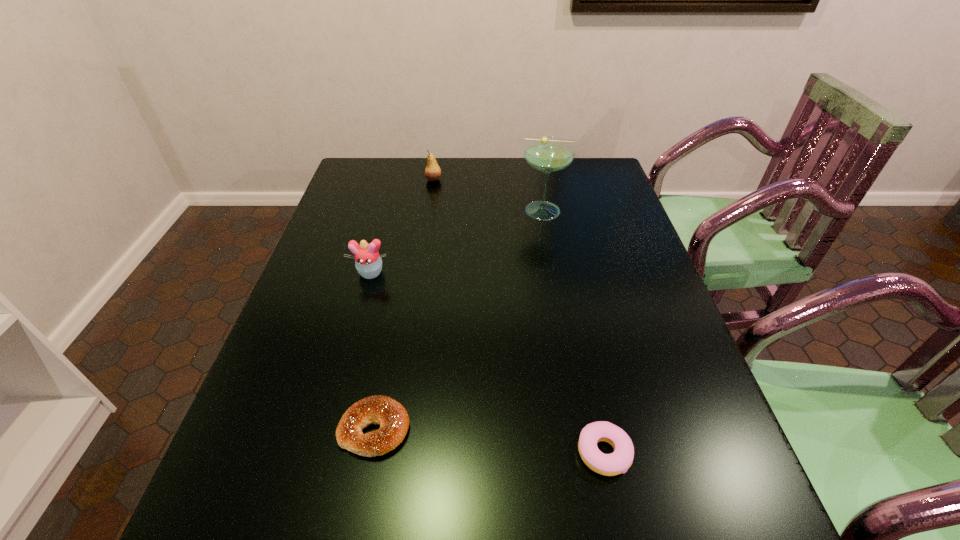
The image size is (960, 540). In order to click on vacant space that is in between the cupcake and the tallest object in this screenshot , I will do `click(458, 242)`.

Where is `vacant region between the pear and the bagel`? vacant region between the pear and the bagel is located at coordinates (404, 304).

Find the location of a particular element. This screenshot has height=540, width=960. free point between the pear and the fourth nearest object is located at coordinates (490, 195).

You are a GUI agent. You are given a task and a screenshot of the screen. Output one action in this format:
    pyautogui.click(x=<x>, y=<y>)
    Task: Click on the free space between the bagel and the tallest object
    
    Given the screenshot: What is the action you would take?
    pyautogui.click(x=460, y=320)

Identify the location of free area in between the bagel and the doughnut. (489, 441).

This screenshot has height=540, width=960. What are the coordinates of `free space between the second farthest object and the doughnut` in the screenshot? It's located at (575, 332).

Where is `free point between the farthest object and the doughnut`? free point between the farthest object and the doughnut is located at coordinates (518, 316).

Locate which object is the second closest to the doughnut. Please provide its 2D coordinates. Your answer should be formatted as a tuple, i.e. [(x, y)], where the tuple contains the x and y coordinates of a point satisfying the conditions above.

[(368, 262)]

Locate an element on the screen. the second closest object to the cupcake is located at coordinates (548, 154).

You are a GUI agent. You are given a task and a screenshot of the screen. Output one action in this format:
    pyautogui.click(x=<x>, y=<y>)
    Task: Click on the vacant area that satisfies the following two spatial constraints: 1. on the face of the bagel; 2. on the right side of the cupcake
    This screenshot has height=540, width=960.
    Given the screenshot: What is the action you would take?
    pyautogui.click(x=328, y=429)